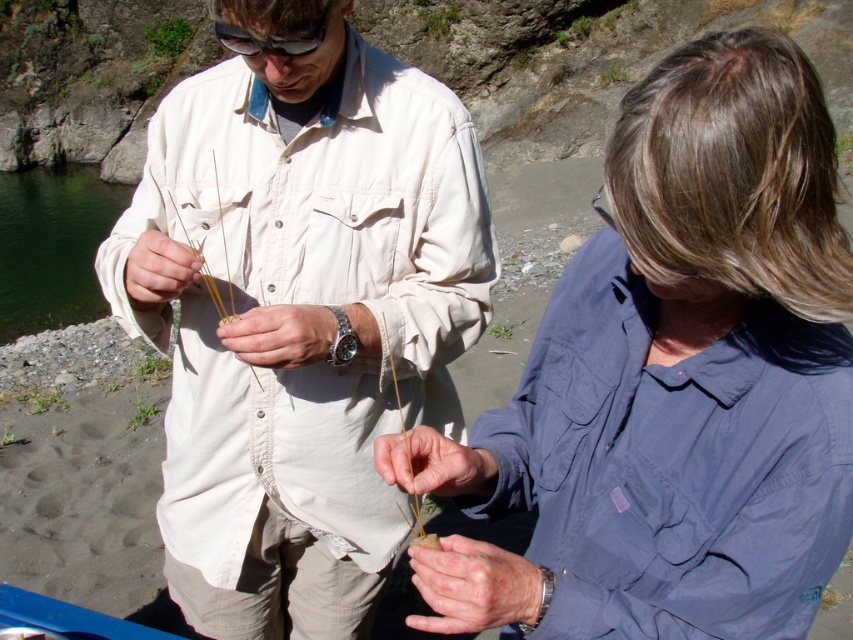
Question: Is smooth tan stick at center smaller than matte black goggles at upper center?

Choices:
 (A) no
 (B) yes

Answer: (B)

Question: Which object is positioned farthest from the dry skin at center?

Choices:
 (A) blue fabric shirt at center
 (B) matte brown stick at center
 (C) smooth tan stick at center
 (D) matte beige stick at center

Answer: (D)

Question: Does blue fabric shirt at center have a smaller size compared to smooth tan stick at center?

Choices:
 (A) no
 (B) yes

Answer: (A)

Question: Which of these objects is positioned closest to the matte black goggles at upper center?

Choices:
 (A) matte beige shirt at center
 (B) matte brown stick at center
 (C) matte beige stick at center

Answer: (C)

Question: Which object appears closest to the camera in this image?

Choices:
 (A) matte beige shirt at center
 (B) matte black goggles at upper center
 (C) smooth tan stick at center

Answer: (C)

Question: Does matte beige stick at center have a greater width compared to matte black goggles at upper center?

Choices:
 (A) yes
 (B) no

Answer: (B)